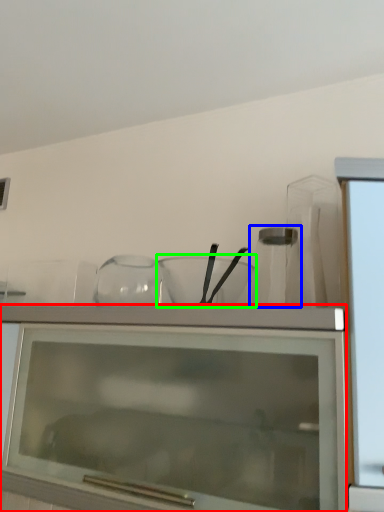
Question: Considering the real-world distances, which object is closest to cabinetry (highlighted by a red box)? glass vase (highlighted by a blue box) or mixing bowl (highlighted by a green box).

Choices:
 (A) glass vase
 (B) mixing bowl

Answer: (B)